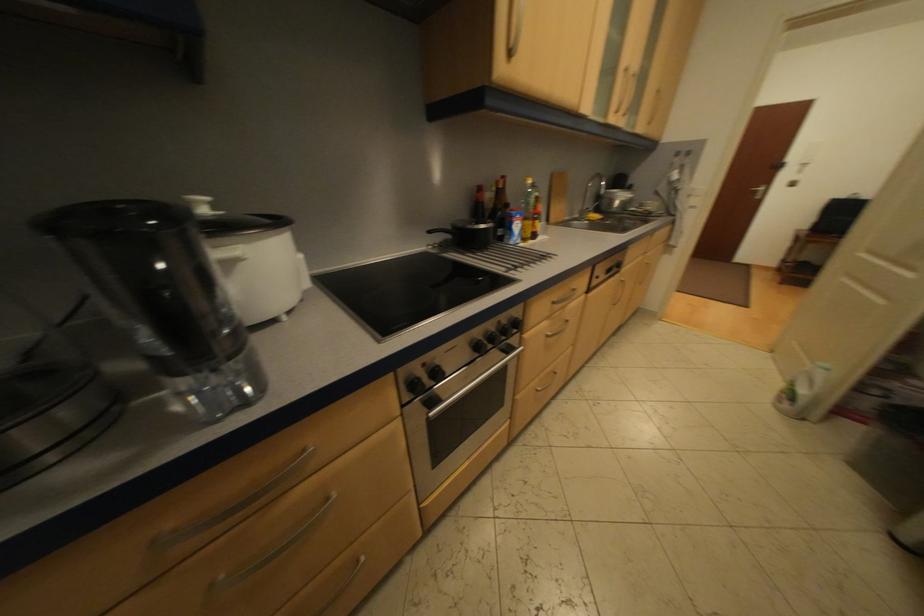
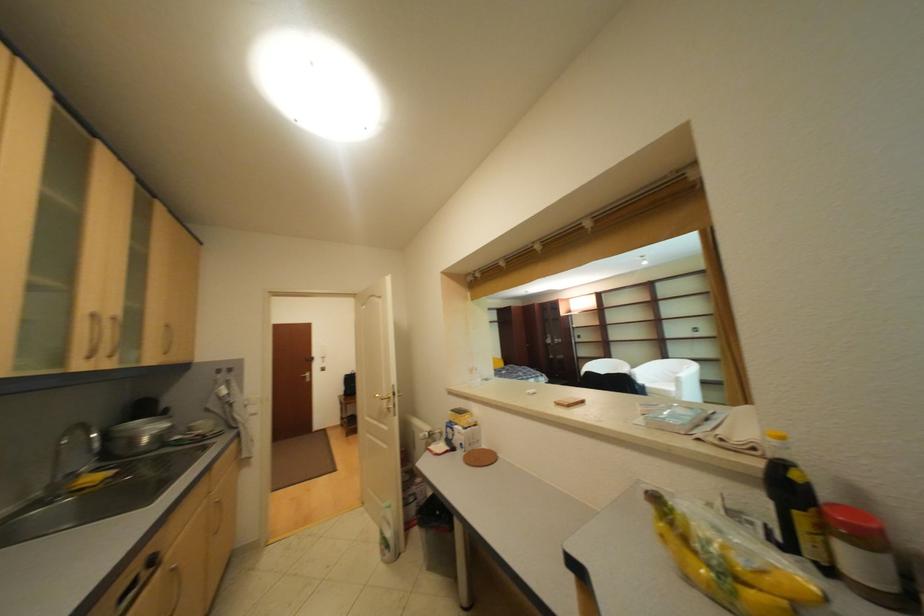
In the second image, find the point that corresponds to [627,114] in the first image.

(101, 359)